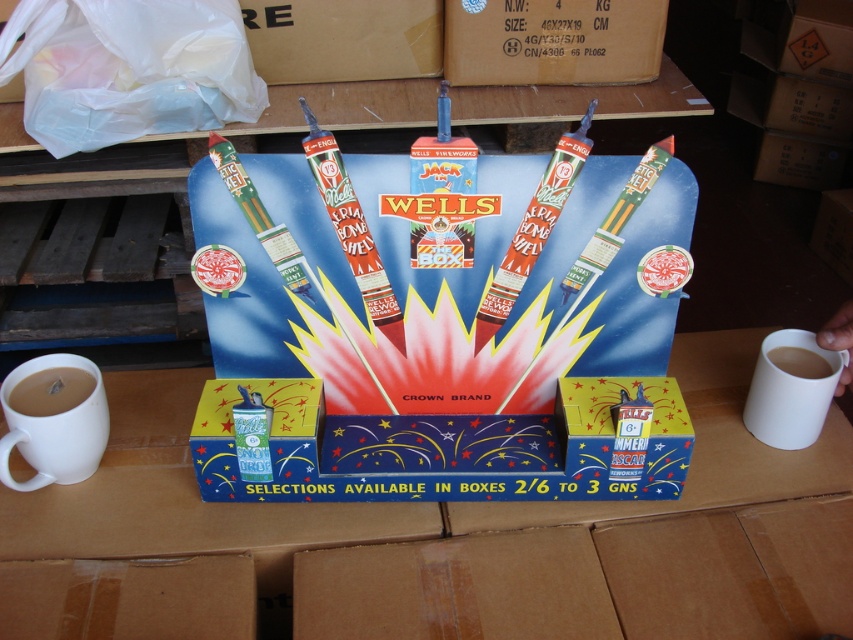
You are at a fireworks stand and see two mugs displayed on the stand. The white matte mug at left and the white ceramic mug at right. Which mug is taller?

The white matte mug at left is much taller than the white ceramic mug at right.

You are at a fireworks stand and see two mugs displayed. The white matte mug at left and the white ceramic mug at right. Which mug is closer to you?

The white matte mug at left is closer to you because it is in front of the white ceramic mug at right.